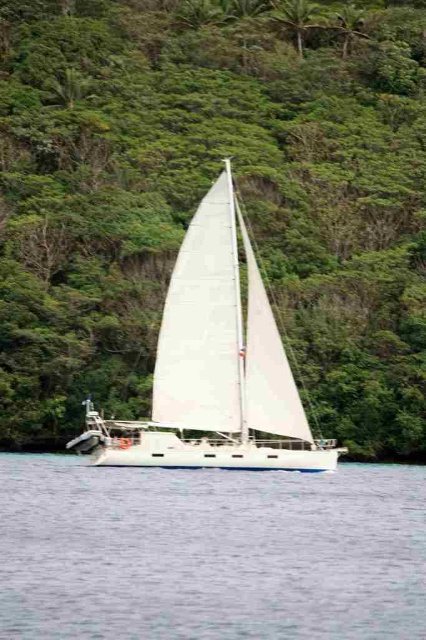
Question: Among these points, which one is farthest from the camera?

Choices:
 (A) (71, 227)
 (B) (98, 417)
 (C) (397, 502)

Answer: (A)

Question: Can you confirm if clear blue water at center is positioned above white matte sailboat at center?

Choices:
 (A) no
 (B) yes

Answer: (A)

Question: Considering the real-world distances, which object is farthest from the white matte sailboat at center?

Choices:
 (A) green leafy tree at center
 (B) clear blue water at center

Answer: (A)

Question: Can you confirm if green leafy tree at center is bigger than clear blue water at center?

Choices:
 (A) no
 (B) yes

Answer: (B)

Question: Is green leafy tree at center to the left of white matte sailboat at center from the viewer's perspective?

Choices:
 (A) no
 (B) yes

Answer: (B)

Question: Which of the following is the farthest from the observer?

Choices:
 (A) (115, 554)
 (B) (298, 4)

Answer: (B)